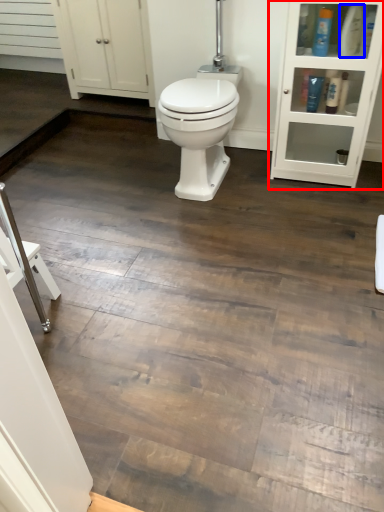
Question: Which point is further to the camera, shelf (highlighted by a red box) or toiletry (highlighted by a blue box)?

Choices:
 (A) shelf
 (B) toiletry

Answer: (B)